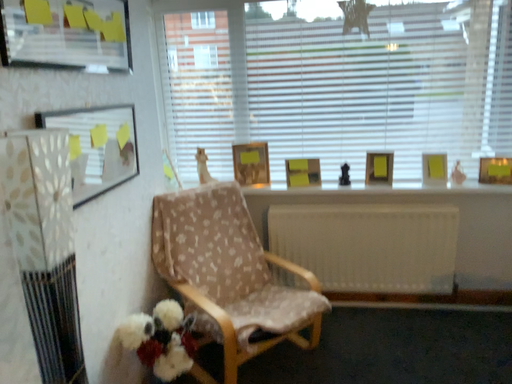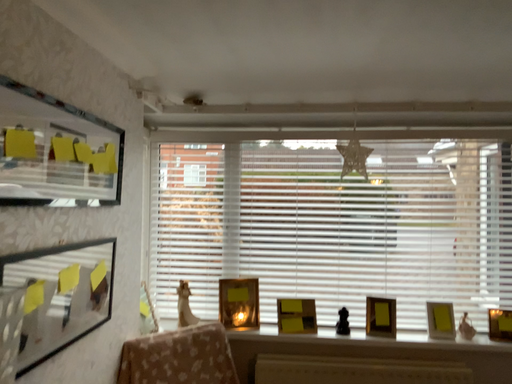
Question: Which way did the camera rotate in the video?

Choices:
 (A) rotated downward
 (B) rotated upward

Answer: (B)